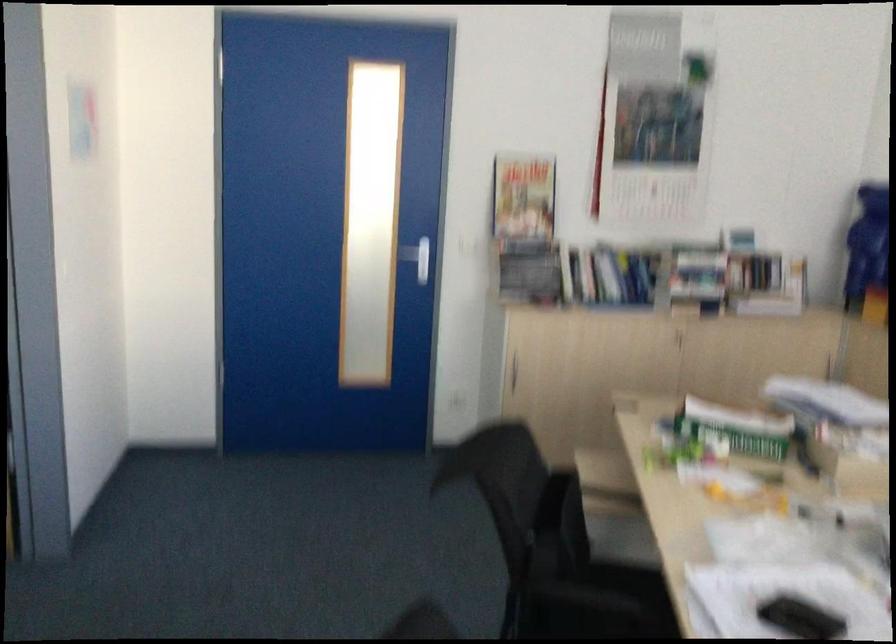
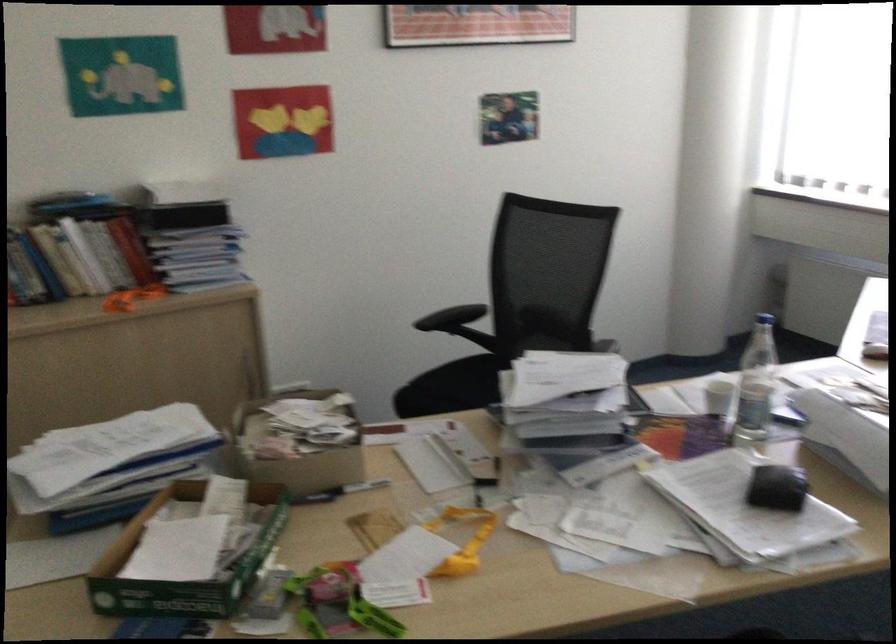
Locate, in the second image, the point that corresponds to (677,458) in the first image.

(345, 603)